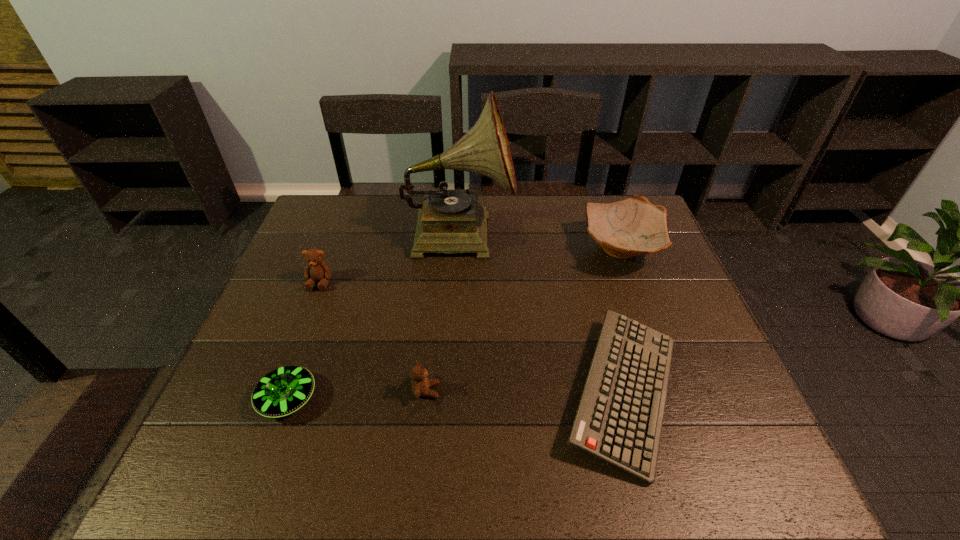
I want to click on vacant space that satisfies the following two spatial constraints: 1. on the face of the saucer; 2. on the left side of the left teddy bear, so click(x=276, y=399).

Identify the location of vacant space that satisfies the following two spatial constraints: 1. on the back side of the pottery; 2. from the horn of the record player. (616, 233).

Where is `free point that satisfies the following two spatial constraints: 1. at the face of the nearer teddy bear; 2. on the right side of the shortest object`? free point that satisfies the following two spatial constraints: 1. at the face of the nearer teddy bear; 2. on the right side of the shortest object is located at coordinates (426, 392).

The image size is (960, 540). Identify the location of free space that satisfies the following two spatial constraints: 1. on the face of the shortest object; 2. on the right side of the left teddy bear. (277, 392).

Identify the location of vacant space that satisfies the following two spatial constraints: 1. from the horn of the record player; 2. on the face of the farther teddy bear. The height and width of the screenshot is (540, 960). (457, 282).

At what (x,y) coordinates should I click in order to perform the action: click on vacant point that satisfies the following two spatial constraints: 1. on the back side of the pottery; 2. from the horn of the tallest object. Please return your answer as a coordinate pair (x, y). Looking at the image, I should click on (616, 233).

Find the location of a particular element. vacant space that satisfies the following two spatial constraints: 1. from the horn of the record player; 2. on the face of the left teddy bear is located at coordinates (457, 282).

At what (x,y) coordinates should I click in order to perform the action: click on vacant space that satisfies the following two spatial constraints: 1. at the face of the nearer teddy bear; 2. on the front side of the saucer. Please return your answer as a coordinate pair (x, y). Looking at the image, I should click on (425, 399).

You are a GUI agent. You are given a task and a screenshot of the screen. Output one action in this format:
    pyautogui.click(x=<x>, y=<y>)
    Task: Click on the blank space that satisfies the following two spatial constraints: 1. on the face of the saucer; 2. on the right side of the left teddy bear
    This screenshot has width=960, height=540.
    Given the screenshot: What is the action you would take?
    pyautogui.click(x=276, y=399)

This screenshot has width=960, height=540. I want to click on free space that satisfies the following two spatial constraints: 1. from the horn of the record player; 2. on the back side of the pottery, so click(459, 249).